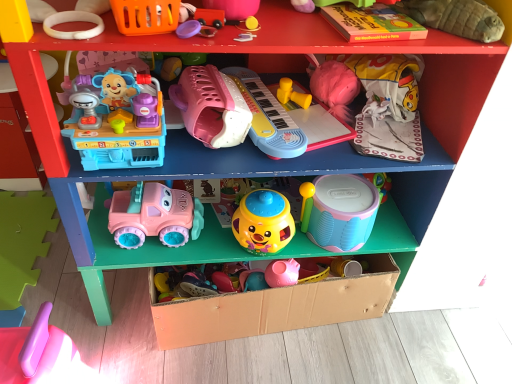
Question: Is rubber duck at upper center, which is counted as the 5th toy, starting from the left, completely or partially inside rubber duck at upper center, arranged as the 3th toy when viewed from the right?

Choices:
 (A) yes
 (B) no

Answer: (B)

Question: From a real-world perspective, is rubber duck at upper center, arranged as the 3th toy when viewed from the right, below rubber duck at upper center, the 8th toy when ordered from right to left?

Choices:
 (A) yes
 (B) no

Answer: (A)

Question: Is rubber duck at upper center, arranged as the 3th toy when viewed from the right, to the left of rubber duck at upper center, which is counted as the 5th toy, starting from the left, from the viewer's perspective?

Choices:
 (A) no
 (B) yes

Answer: (A)

Question: Considering the relative sizes of rubber duck at upper center, arranged as the 3th toy when viewed from the right, and rubber duck at upper center, which is counted as the 5th toy, starting from the left, in the image provided, is rubber duck at upper center, arranged as the 3th toy when viewed from the right, smaller than rubber duck at upper center, which is counted as the 5th toy, starting from the left,?

Choices:
 (A) yes
 (B) no

Answer: (A)

Question: Can you confirm if rubber duck at upper center, arranged as the tenth toy when viewed from the left, is positioned to the right of rubber duck at upper center, the 8th toy when ordered from right to left?

Choices:
 (A) yes
 (B) no

Answer: (A)

Question: From the image's perspective, is rubber duck at upper center, arranged as the tenth toy when viewed from the left, on top of rubber duck at upper center, which is counted as the 5th toy, starting from the left?

Choices:
 (A) yes
 (B) no

Answer: (B)

Question: Does yellow rubber ball at upper center, which is the 7th toy in right-to-left order, lie behind pastel blue plastic drum at center, the second toy viewed from the right?

Choices:
 (A) no
 (B) yes

Answer: (A)

Question: Can you confirm if yellow rubber ball at upper center, which is the sixth toy in left-to-right order, is positioned to the right of pastel blue plastic drum at center, which is the eleventh toy from left to right?

Choices:
 (A) yes
 (B) no

Answer: (B)

Question: From the image's perspective, is yellow rubber ball at upper center, which is the sixth toy in left-to-right order, above pastel blue plastic drum at center, the second toy viewed from the right?

Choices:
 (A) yes
 (B) no

Answer: (A)

Question: From a real-world perspective, is yellow rubber ball at upper center, which is the 7th toy in right-to-left order, beneath pastel blue plastic drum at center, which is the eleventh toy from left to right?

Choices:
 (A) yes
 (B) no

Answer: (B)

Question: Is yellow rubber ball at upper center, which is the sixth toy in left-to-right order, oriented towards pastel blue plastic drum at center, the second toy viewed from the right?

Choices:
 (A) yes
 (B) no

Answer: (B)

Question: Can you confirm if yellow rubber ball at upper center, which is the sixth toy in left-to-right order, is wider than pastel blue plastic drum at center, the second toy viewed from the right?

Choices:
 (A) yes
 (B) no

Answer: (B)

Question: Is soft plush turtle at upper right, the twelfth toy positioned from the left, behind yellow plastic toy at upper center, marked as the 4th toy in a right-to-left arrangement?

Choices:
 (A) yes
 (B) no

Answer: (B)